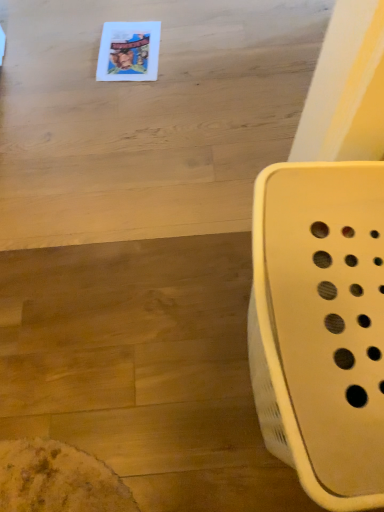
You are a GUI agent. You are given a task and a screenshot of the screen. Output one action in this format:
    pyautogui.click(x=<x>, y=<y>)
    Task: Click on the matte wood table at upper center
    
    Given the screenshot: What is the action you would take?
    pyautogui.click(x=147, y=118)

The height and width of the screenshot is (512, 384). Describe the element at coordinates (147, 118) in the screenshot. I see `matte wood table at upper center` at that location.

This screenshot has width=384, height=512. Find the location of `white plastic laundry basket at right`. white plastic laundry basket at right is located at coordinates (321, 326).

What is the approximate height of white plastic laundry basket at right?

The height of white plastic laundry basket at right is 58.08 centimeters.

What do you see at coordinates (321, 326) in the screenshot? I see `white plastic laundry basket at right` at bounding box center [321, 326].

I want to click on matte wood table at upper center, so click(147, 118).

From the picture: Based on their positions, is white plastic laundry basket at right located to the left or right of matte wood table at upper center?

Based on their positions, white plastic laundry basket at right is located to the right of matte wood table at upper center.

Is white plastic laundry basket at right in front of or behind matte wood table at upper center in the image?

Visually, white plastic laundry basket at right is located in front of matte wood table at upper center.

Is point (364, 336) farther from viewer compared to point (179, 96)?

No, it is in front of (179, 96).

From the image's perspective, which is below, white plastic laundry basket at right or matte wood table at upper center?

white plastic laundry basket at right, from the image's perspective.

From a real-world perspective, does white plastic laundry basket at right sit lower than matte wood table at upper center?

Actually, white plastic laundry basket at right is physically above matte wood table at upper center in the real world.

Is white plastic laundry basket at right wider than matte wood table at upper center?

No.

Does white plastic laundry basket at right have a lesser height compared to matte wood table at upper center?

No, white plastic laundry basket at right is not shorter than matte wood table at upper center.

Which of these two, white plastic laundry basket at right or matte wood table at upper center, is smaller?

matte wood table at upper center is smaller.

Is white plastic laundry basket at right spatially inside matte wood table at upper center, or outside of it?

white plastic laundry basket at right is spatially situated outside matte wood table at upper center.

Would you say white plastic laundry basket at right is a long distance from matte wood table at upper center?

No, there isn't a large distance between white plastic laundry basket at right and matte wood table at upper center.

Does white plastic laundry basket at right turn towards matte wood table at upper center?

No, white plastic laundry basket at right is not aimed at matte wood table at upper center.

How distant is white plastic laundry basket at right from matte wood table at upper center?

white plastic laundry basket at right and matte wood table at upper center are 33.08 inches apart.

In order to click on table lying above the white plastic laundry basket at right (from the image's perspective) in this screenshot , I will do `click(147, 118)`.

Does matte wood table at upper center appear on the left side of white plastic laundry basket at right?

Correct, you'll find matte wood table at upper center to the left of white plastic laundry basket at right.

Relative to white plastic laundry basket at right, is matte wood table at upper center in front or behind?

Visually, matte wood table at upper center is located behind white plastic laundry basket at right.

Considering the points (268, 152) and (255, 384), which point is behind, point (268, 152) or point (255, 384)?

The point (268, 152) is more distant.

From the image's perspective, which is below, matte wood table at upper center or white plastic laundry basket at right?

From the image's view, white plastic laundry basket at right is below.

From a real-world perspective, which object rests below the other?

matte wood table at upper center.

Does matte wood table at upper center have a lesser width compared to white plastic laundry basket at right?

In fact, matte wood table at upper center might be wider than white plastic laundry basket at right.

From their relative heights in the image, would you say matte wood table at upper center is taller or shorter than white plastic laundry basket at right?

Considering their sizes, matte wood table at upper center has less height than white plastic laundry basket at right.

Considering the relative sizes of matte wood table at upper center and white plastic laundry basket at right in the image provided, is matte wood table at upper center smaller than white plastic laundry basket at right?

Correct, matte wood table at upper center occupies less space than white plastic laundry basket at right.

Is matte wood table at upper center located outside white plastic laundry basket at right?

matte wood table at upper center lies outside white plastic laundry basket at right's area.

Is matte wood table at upper center not close to white plastic laundry basket at right?

No, there isn't a large distance between matte wood table at upper center and white plastic laundry basket at right.

Is matte wood table at upper center facing away from white plastic laundry basket at right?

matte wood table at upper center is not turned away from white plastic laundry basket at right.

How different are the orientations of matte wood table at upper center and white plastic laundry basket at right in degrees?

89.1 degrees separate the facing orientations of matte wood table at upper center and white plastic laundry basket at right.

What are the coordinates of `furniture in front of the matte wood table at upper center` in the screenshot? It's located at (321, 326).

I want to click on furniture on the right of the matte wood table at upper center, so click(x=321, y=326).

This screenshot has width=384, height=512. I want to click on table located behind the white plastic laundry basket at right, so click(x=147, y=118).